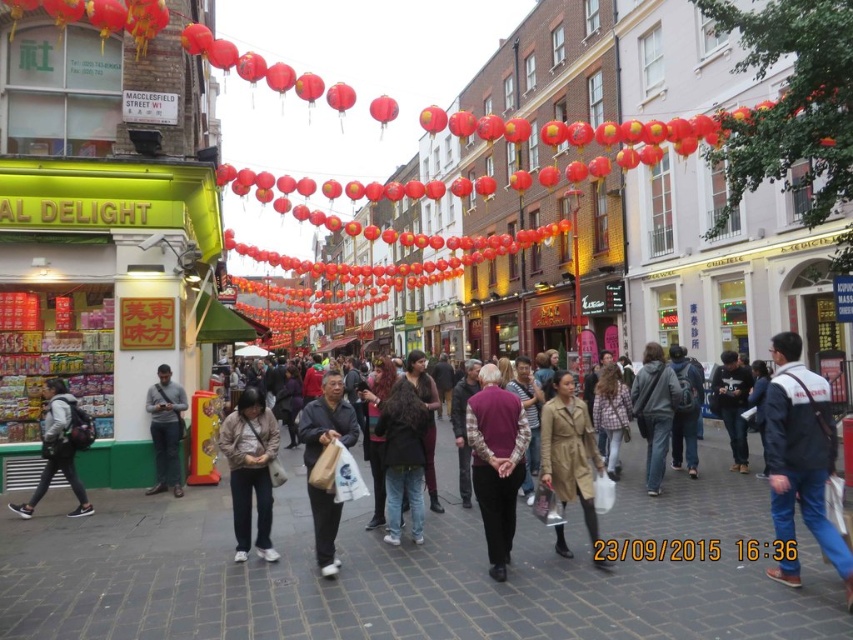
Is point (263, 397) positioned in front of point (82, 445)?

Yes, it is.

Is light brown fabric jacket at center shorter than matte black backpack at lower left?

Correct, light brown fabric jacket at center is not as tall as matte black backpack at lower left.

Between point (254, 506) and point (83, 410), which one is positioned in front?

Point (254, 506) is more forward.

Find the location of `light brown fabric jacket at center`. light brown fabric jacket at center is located at coordinates (250, 470).

Can you confirm if light brown fabric jacket at center is bigger than dark brown leather jacket at center?

Actually, light brown fabric jacket at center might be smaller than dark brown leather jacket at center.

Which of these two, light brown fabric jacket at center or dark brown leather jacket at center, stands shorter?

Standing shorter between the two is light brown fabric jacket at center.

This screenshot has height=640, width=853. What are the coordinates of `light brown fabric jacket at center` in the screenshot? It's located at (250, 470).

Which of these two, matte black backpack at lower left or black matte jacket at center, stands shorter?

matte black backpack at lower left is shorter.

Can you confirm if matte black backpack at lower left is taller than black matte jacket at center?

No, matte black backpack at lower left is not taller than black matte jacket at center.

Where is `matte black backpack at lower left`? The height and width of the screenshot is (640, 853). matte black backpack at lower left is located at coordinates (61, 448).